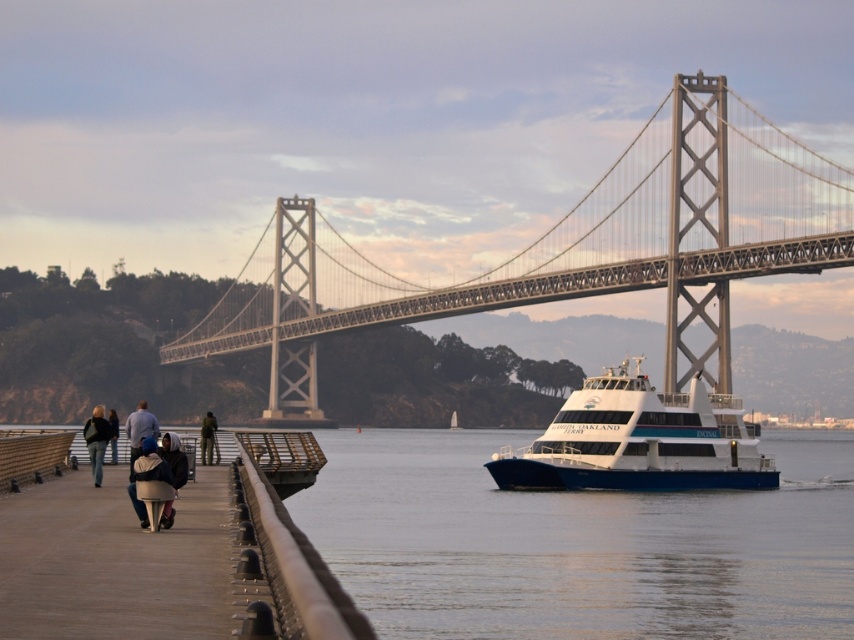
Question: Does white glossy catamaran at center have a greater width compared to white fabric jacket at lower left?

Choices:
 (A) no
 (B) yes

Answer: (B)

Question: Based on their relative distances, which object is farther from the transparent water at center?

Choices:
 (A) light gray jacket at left
 (B) dark gray jacket at left
 (C) white glossy catamaran at center
 (D) white fabric jacket at lower left

Answer: (D)

Question: Which point is farther to the camera?

Choices:
 (A) transparent water at center
 (B) dark blue jacket at left

Answer: (B)

Question: Can you confirm if transparent water at center is positioned to the right of green fabric jacket at left?

Choices:
 (A) yes
 (B) no

Answer: (A)

Question: Does green fabric jacket at left come in front of dark blue jacket at left?

Choices:
 (A) yes
 (B) no

Answer: (B)

Question: Which object is the farthest from the light gray jacket at left?

Choices:
 (A) white fabric jacket at lower left
 (B) green fabric jacket at left
 (C) metallic gray bridge at center
 (D) white glossy catamaran at center

Answer: (C)